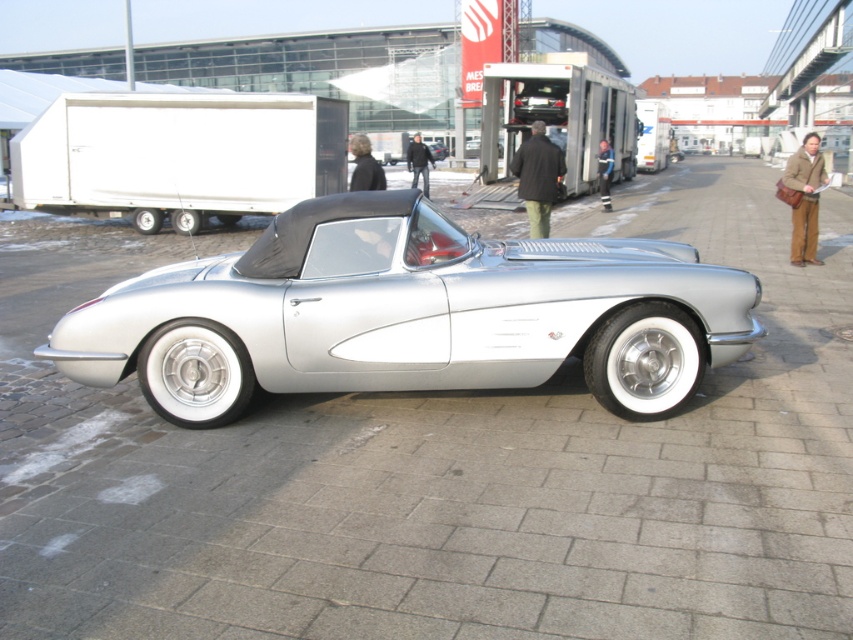
Based on the photo, you are a photographer setting up equipment to capture the silver metallic sports car at center and the matte white trailer at left. From your current position, which object is closer to the left side of your frame?

The matte white trailer at left is closer to the left side of the frame since the silver metallic sports car at center is positioned on the right side of it.

You are a photographer standing at the edge of the paved area. You want to take a photo of the silver metallic car at center without including the green pants at center in the frame. Given their sizes, is this possible?

The green pants at center is not as tall as silver metallic car at center, so the photographer can position themselves to focus on the silver metallic car at center while excluding the green pants at center from the shot by adjusting the camera angle or distance.

You are a delivery driver who needs to enter a low clearance tunnel that has a height limit of 2 meters. You have a silver metallic sports car at center and a matte white trailer at left available for the trip. Which vehicle should you choose to ensure it fits under the tunnel?

The matte white trailer at left is shorter than the silver metallic sports car at center, so you should choose the matte white trailer at left to ensure it fits under the 2 meter height limit.